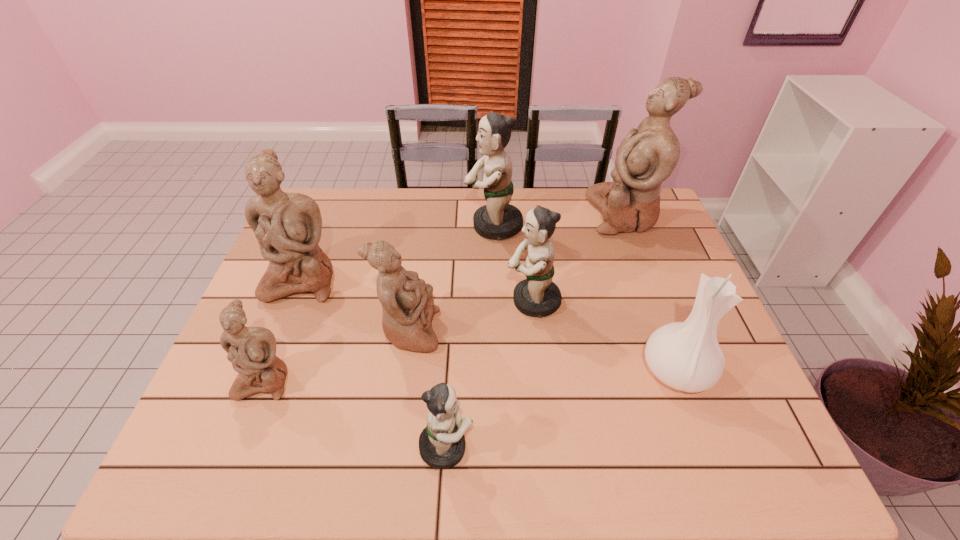
Locate an element on the screen. This screenshot has width=960, height=540. vacant area at the far edge is located at coordinates click(x=464, y=200).

Identify the location of free space at the right edge. The height and width of the screenshot is (540, 960). (657, 270).

At what (x,y) coordinates should I click in order to perform the action: click on vacant space at the near right corner of the desktop. Please return your answer as a coordinate pair (x, y). Looking at the image, I should click on (x=739, y=468).

You are a GUI agent. You are given a task and a screenshot of the screen. Output one action in this format:
    pyautogui.click(x=<x>, y=<y>)
    Task: Click on the unoccupied position between the rightmost white figurine and the vase
    The height and width of the screenshot is (540, 960).
    Given the screenshot: What is the action you would take?
    pyautogui.click(x=650, y=293)

Locate an element on the screen. The width and height of the screenshot is (960, 540). free space between the sixth farthest figurine and the nearest figurine is located at coordinates (355, 413).

Locate an element on the screen. empty space that is in between the smallest green figurine and the second biggest green figurine is located at coordinates (490, 374).

Locate an element on the screen. free space between the sixth farthest figurine and the third white figurine from left to right is located at coordinates (337, 355).

This screenshot has height=540, width=960. I want to click on free space between the smallest green figurine and the second farthest green figurine, so click(490, 374).

Image resolution: width=960 pixels, height=540 pixels. What are the coordinates of `unoccupied area between the nearest figurine and the third farthest white figurine` in the screenshot? It's located at (427, 389).

You are a GUI agent. You are given a task and a screenshot of the screen. Output one action in this format:
    pyautogui.click(x=<x>, y=<y>)
    Task: Click on the free spot between the biggest white figurine and the third smallest white figurine
    
    Given the screenshot: What is the action you would take?
    pyautogui.click(x=463, y=247)